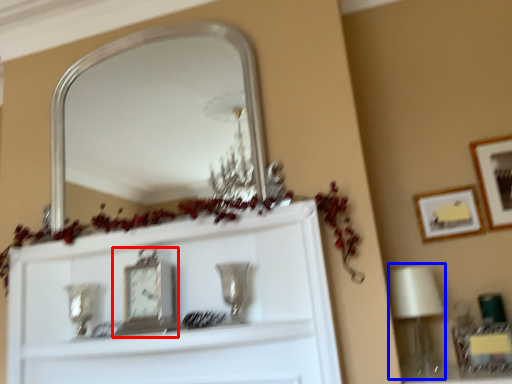
Question: Among these objects, which one is farthest to the camera, clock (highlighted by a red box) or lamp (highlighted by a blue box)?

Choices:
 (A) clock
 (B) lamp

Answer: (B)